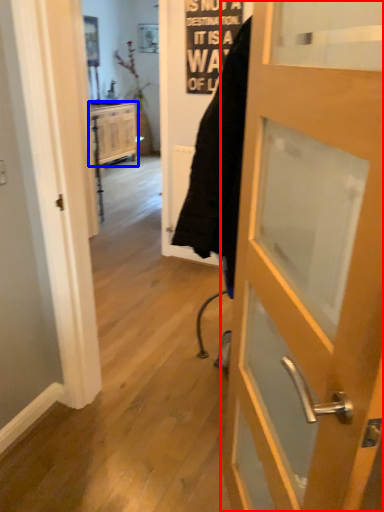
Question: Which point is further to the camera, door (highlighted by a red box) or cabinetry (highlighted by a blue box)?

Choices:
 (A) door
 (B) cabinetry

Answer: (B)